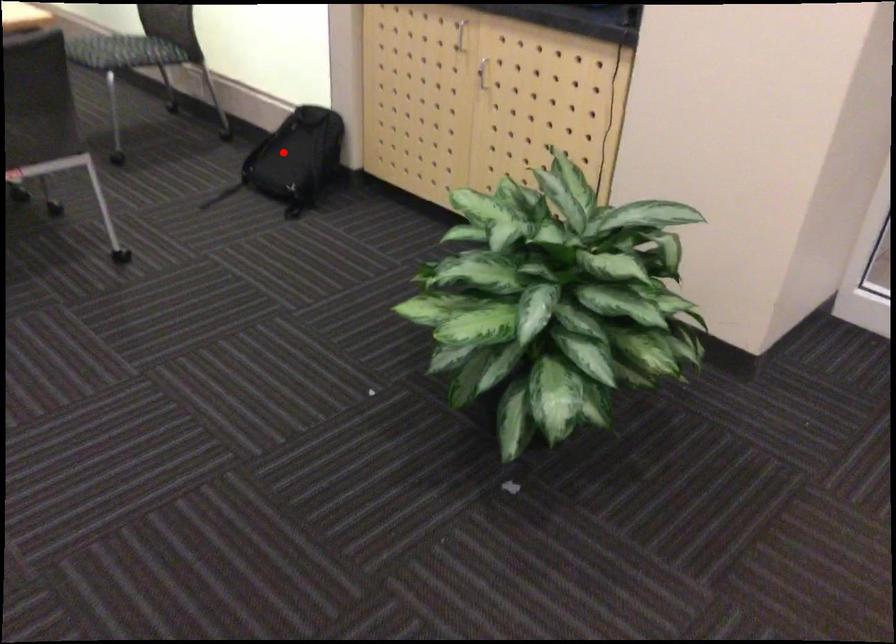
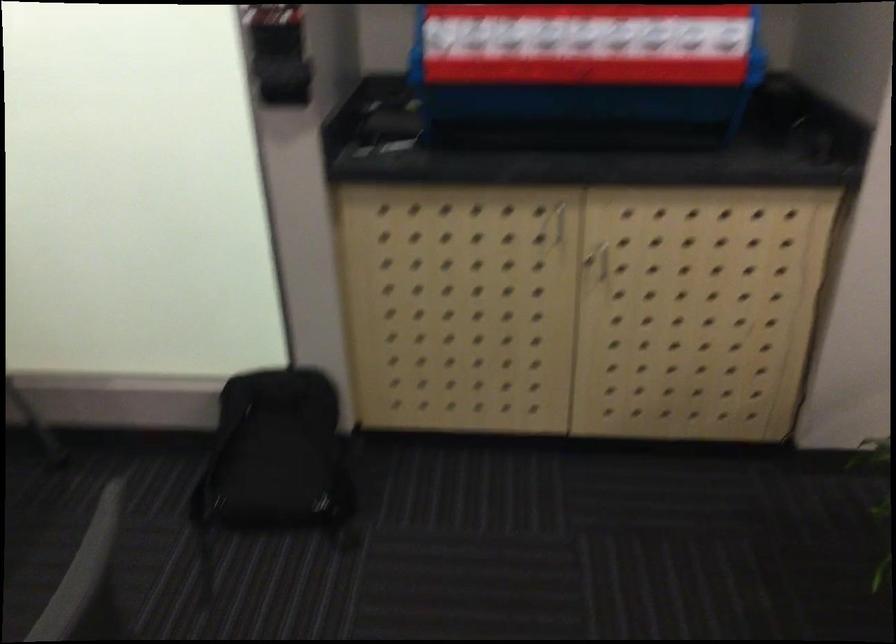
Where in the second image is the point corresponding to the highlighted location from the first image?

(277, 455)